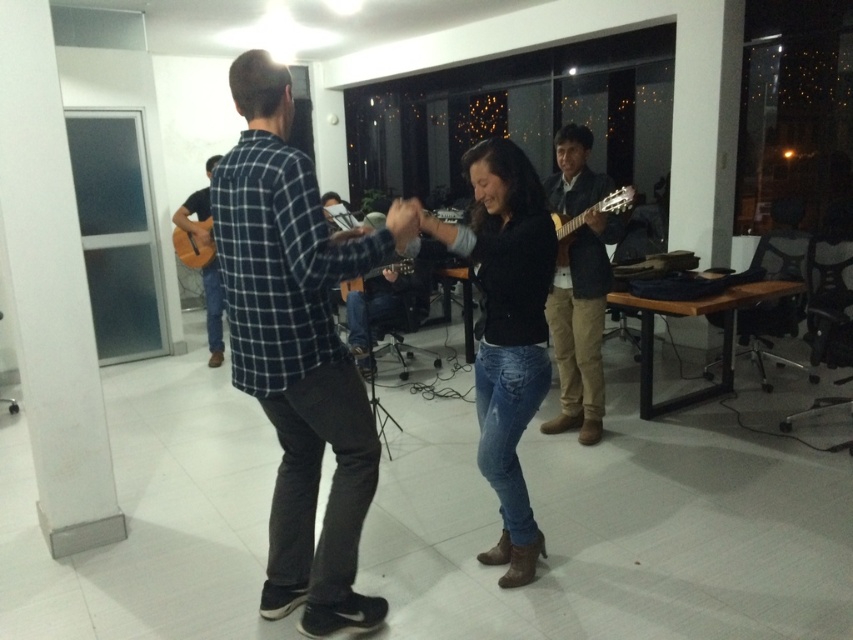
How far apart are blue plaid shirt at center and denim jeans at center?

18.35 inches

The height and width of the screenshot is (640, 853). What do you see at coordinates (299, 348) in the screenshot?
I see `blue plaid shirt at center` at bounding box center [299, 348].

Does point (303, 412) lie behind point (457, 241)?

No, (303, 412) is in front of (457, 241).

You are a GUI agent. You are given a task and a screenshot of the screen. Output one action in this format:
    pyautogui.click(x=<x>, y=<y>)
    Task: Click on the blue plaid shirt at center
    
    Given the screenshot: What is the action you would take?
    [299, 348]

The height and width of the screenshot is (640, 853). Describe the element at coordinates (299, 348) in the screenshot. I see `blue plaid shirt at center` at that location.

Is point (248, 196) farther from camera compared to point (347, 285)?

No, (248, 196) is in front of (347, 285).

Where is `blue plaid shirt at center`? The image size is (853, 640). blue plaid shirt at center is located at coordinates (299, 348).

The height and width of the screenshot is (640, 853). What do you see at coordinates (299, 348) in the screenshot?
I see `blue plaid shirt at center` at bounding box center [299, 348].

Is blue plaid shirt at center smaller than matte brown acoustic guitar at center?

No, blue plaid shirt at center is not smaller than matte brown acoustic guitar at center.

Is point (376, 625) positioned before point (592, 208)?

That is True.

The width and height of the screenshot is (853, 640). I want to click on blue plaid shirt at center, so [x=299, y=348].